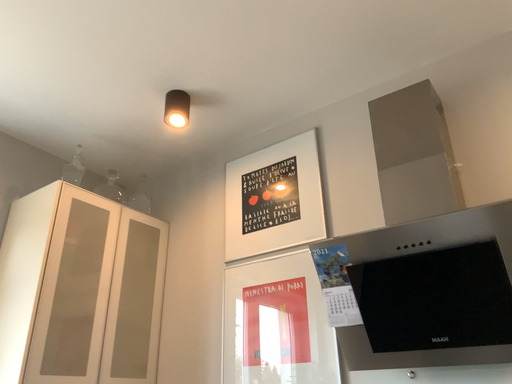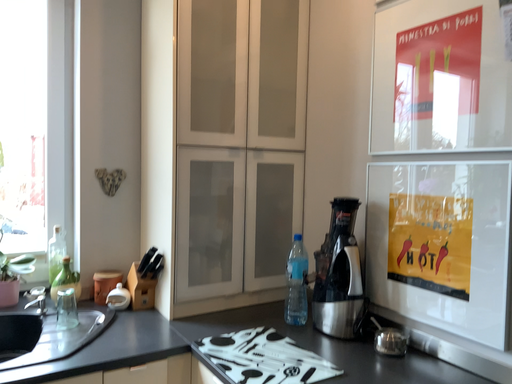
Question: Which way did the camera rotate in the video?

Choices:
 (A) rotated upward
 (B) rotated downward

Answer: (B)